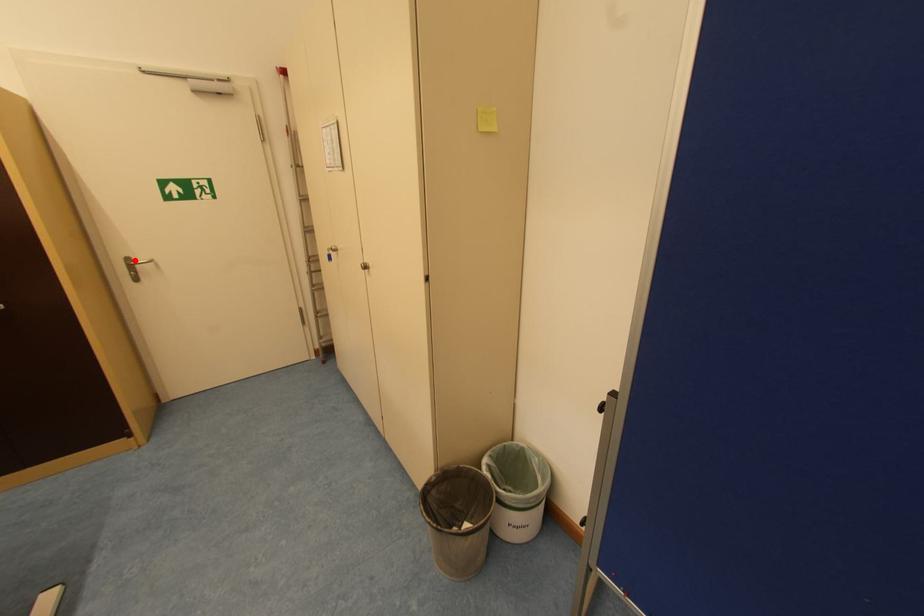
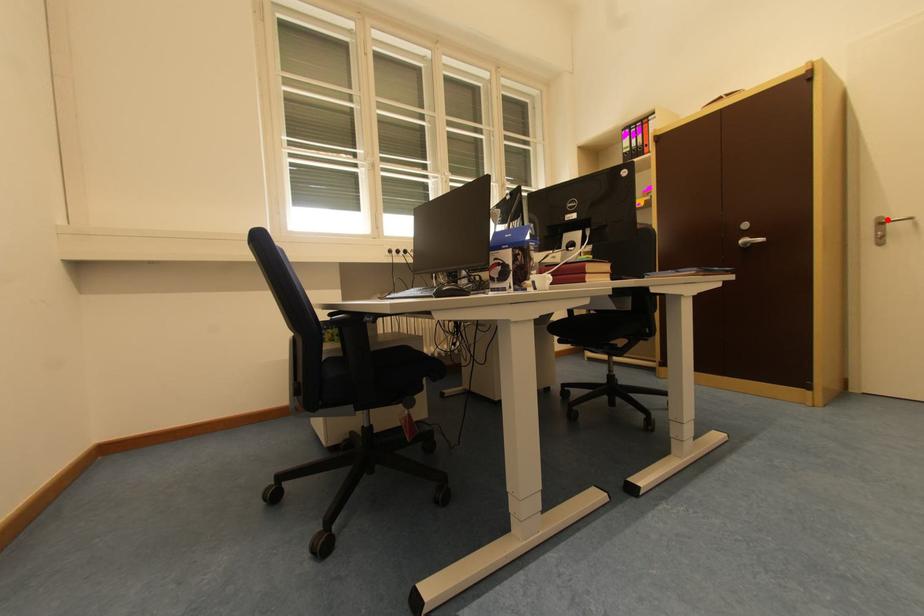
I am providing you with two images of the same scene from different viewpoints. A red point is marked on the first image and another point is marked on the second image. Is the marked point in image1 the same physical position as the marked point in image2?

Yes